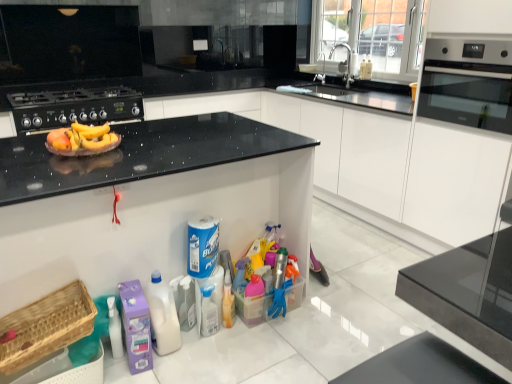
Question: Is point (111, 119) positioned closer to the camera than point (202, 301)?

Choices:
 (A) farther
 (B) closer

Answer: (A)

Question: Is black matte gas stove at upper left wider or thinner than translucent plastic spray bottle at center?

Choices:
 (A) thin
 (B) wide

Answer: (B)

Question: Which object is the closest to the white plastic bottle at lower center, positioned as the second cleaning product in right-to-left order?

Choices:
 (A) translucent plastic spray bottle at center
 (B) black glass oven at right
 (C) silver metallic faucet at upper center, marked as the first faucet in a back-to-front arrangement
 (D) yellow matte bananas at center
 (E) woven wood basket at lower left

Answer: (A)

Question: Considering the real-world distances, which object is closest to the white plastic bottle at lower center, the second cleaning product viewed from the left?

Choices:
 (A) blue paper towel at center, which ranks as the first cleaning product in right-to-left order
 (B) purple plastic laundry detergent at lower left, the first cleaning product when ordered from left to right
 (C) white glossy cabinet at upper center
 (D) silver metallic faucet at upper center, marked as the first faucet in a back-to-front arrangement
 (E) black matte gas stove at upper left

Answer: (B)